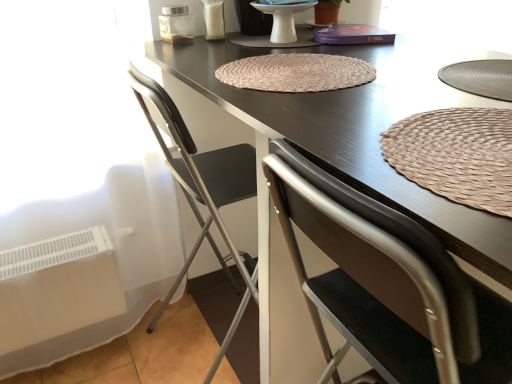
Question: Should I look upward or downward to see brown woven mat at center, which appears as the 2th mat when viewed from the back?

Choices:
 (A) up
 (B) down

Answer: (A)

Question: Is brown woven mat at center, which is the 1th mat from bottom to top, facing away from matte ceramic plate at center?

Choices:
 (A) yes
 (B) no

Answer: (B)

Question: From the image's perspective, does brown woven mat at center, which appears as the 2th mat when viewed from the back, appear lower than matte ceramic plate at center?

Choices:
 (A) no
 (B) yes

Answer: (B)

Question: Can you confirm if brown woven mat at center, arranged as the 2th mat when viewed from the top, is positioned to the right of matte ceramic plate at center?

Choices:
 (A) yes
 (B) no

Answer: (A)

Question: From a real-world perspective, is brown woven mat at center, which appears as the 2th mat when viewed from the back, under matte ceramic plate at center?

Choices:
 (A) yes
 (B) no

Answer: (A)

Question: Can you confirm if brown woven mat at center, which appears as the 2th mat when viewed from the back, is wider than matte ceramic plate at center?

Choices:
 (A) no
 (B) yes

Answer: (B)

Question: Does brown woven mat at center, which is the 1th mat from bottom to top, turn towards matte ceramic plate at center?

Choices:
 (A) no
 (B) yes

Answer: (A)

Question: Would you say brown woven mat at center, arranged as the first mat when viewed from the top, is part of brown woven mat at center, which appears as the 2th mat when viewed from the back,'s contents?

Choices:
 (A) yes
 (B) no

Answer: (B)

Question: Does brown woven mat at center, which is the 1th mat from bottom to top, appear on the right side of brown woven mat at center, placed as the first mat when sorted from back to front?

Choices:
 (A) yes
 (B) no

Answer: (A)

Question: Is brown woven mat at center, which appears as the 2th mat when viewed from the back, positioned behind brown woven mat at center, placed as the first mat when sorted from back to front?

Choices:
 (A) no
 (B) yes

Answer: (A)

Question: From the image's perspective, is brown woven mat at center, which is the 1th mat from bottom to top, over brown woven mat at center, the second mat ordered from the bottom?

Choices:
 (A) no
 (B) yes

Answer: (A)

Question: Can you confirm if brown woven mat at center, arranged as the 2th mat when viewed from the top, is bigger than brown woven mat at center, the second mat ordered from the bottom?

Choices:
 (A) yes
 (B) no

Answer: (A)

Question: Is brown woven mat at center, which is the 1th mat from bottom to top, positioned beyond the bounds of brown woven mat at center, the second mat ordered from the bottom?

Choices:
 (A) no
 (B) yes

Answer: (B)

Question: From the image's perspective, would you say dark brown wood table at center is shown under brown woven mat at center, arranged as the first mat when viewed from the top?

Choices:
 (A) no
 (B) yes

Answer: (B)